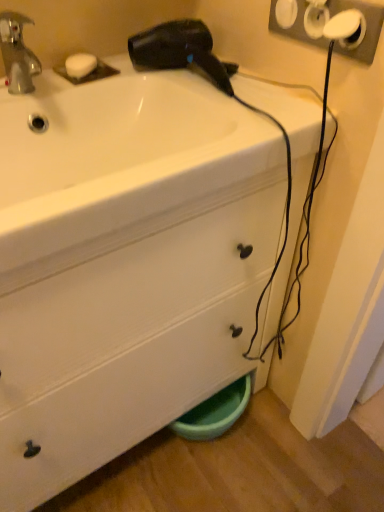
You are a GUI agent. You are given a task and a screenshot of the screen. Output one action in this format:
    pyautogui.click(x=<x>, y=<y>)
    Task: Click on the free space in front of white matte soap at upper left
    
    Given the screenshot: What is the action you would take?
    pyautogui.click(x=56, y=88)